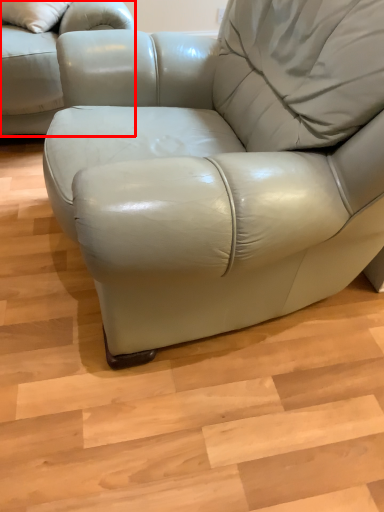
Question: From the image, what is the correct spatial relationship of studio couch (annotated by the red box) in relation to table?

Choices:
 (A) left
 (B) right

Answer: (A)